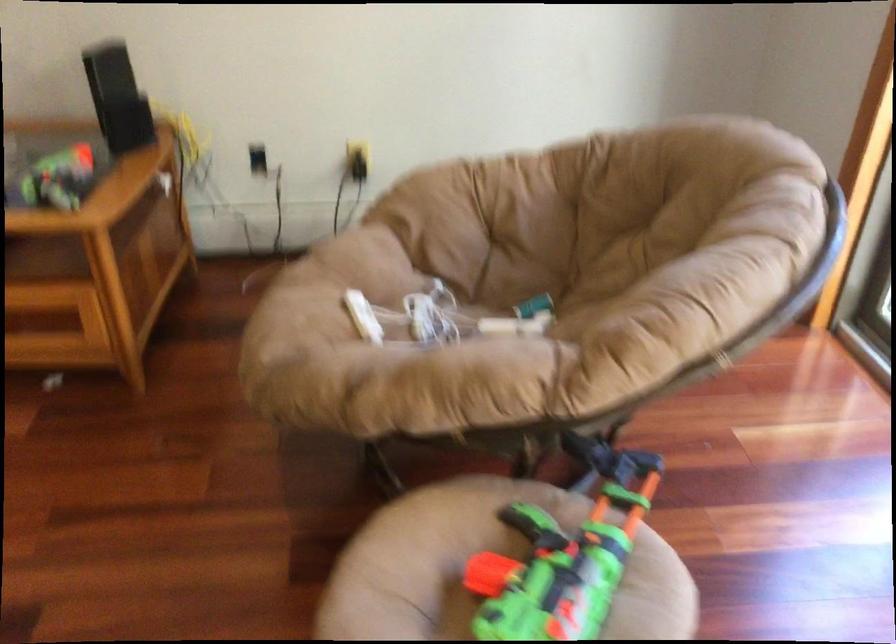
Find where to sit the chair sitting surface. Please return your answer as a coordinate pair (x, y).

(442, 317)